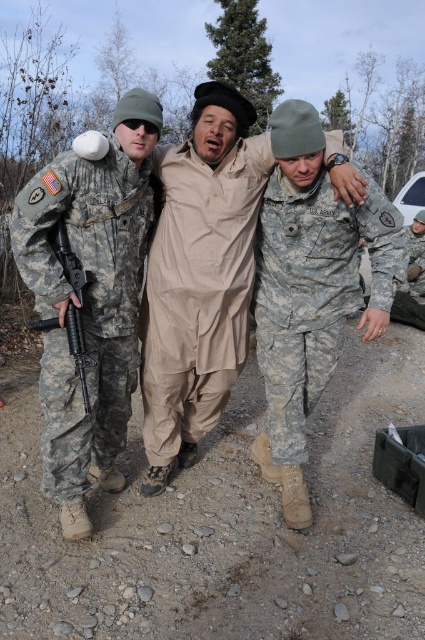
Question: Among these objects, which one is farthest from the camera?

Choices:
 (A) matte black rifle at left
 (B) camouflage fabric uniform at center
 (C) beige fabric outfit at center

Answer: (C)

Question: Which of the following is the farthest from the observer?

Choices:
 (A) (152, 248)
 (B) (37, 259)
 (C) (62, 253)

Answer: (A)

Question: Observing the image, what is the correct spatial positioning of camouflage fabric uniform at left in reference to matte black rifle at left?

Choices:
 (A) left
 (B) right

Answer: (B)

Question: Is beige fabric outfit at center smaller than camouflage fabric uniform at left?

Choices:
 (A) no
 (B) yes

Answer: (A)

Question: Among these objects, which one is farthest from the camera?

Choices:
 (A) matte black rifle at left
 (B) beige fabric outfit at center

Answer: (B)

Question: Can you confirm if beige fabric outfit at center is wider than camouflage fabric uniform at left?

Choices:
 (A) no
 (B) yes

Answer: (B)